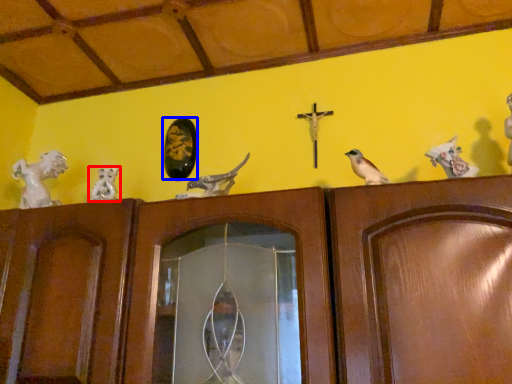
Question: Which object is further to the camera taking this photo, animal (highlighted by a red box) or art (highlighted by a blue box)?

Choices:
 (A) animal
 (B) art

Answer: (B)